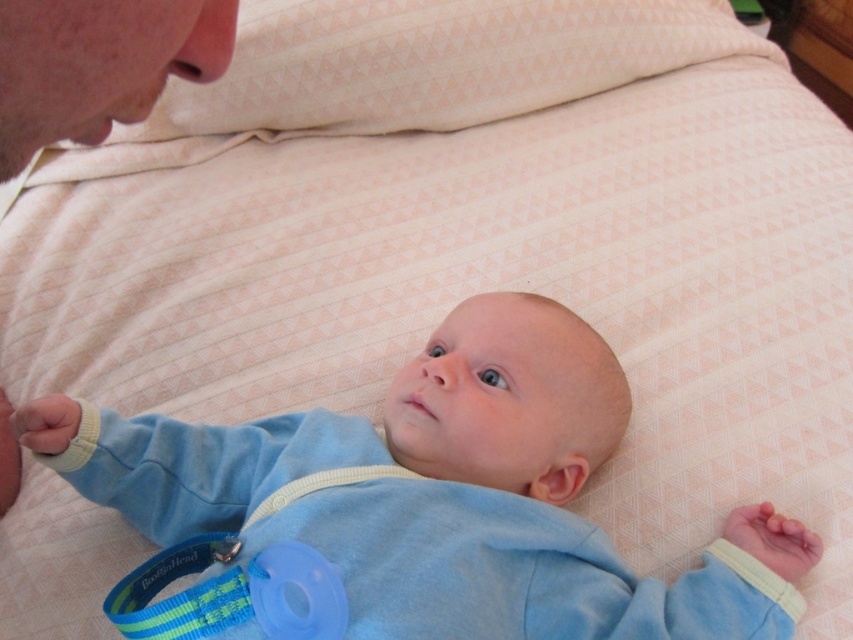
Question: Is light blue soft fabric baby at center above pink textured pillow at upper center?

Choices:
 (A) no
 (B) yes

Answer: (A)

Question: Does light blue soft fabric baby at center have a larger size compared to blue rubber teething ring at lower center?

Choices:
 (A) no
 (B) yes

Answer: (B)

Question: Considering the real-world distances, which object is closest to the blue rubber teething ring at lower center?

Choices:
 (A) light blue soft fabric baby at center
 (B) pink textured pillow at upper center

Answer: (A)

Question: Which object is positioned closest to the blue rubber teething ring at lower center?

Choices:
 (A) pink textured pillow at upper center
 (B) light blue soft fabric baby at center

Answer: (B)

Question: Does pink textured pillow at upper center have a lesser width compared to blue rubber teething ring at lower center?

Choices:
 (A) no
 (B) yes

Answer: (A)

Question: Which point appears farthest from the camera in this image?

Choices:
 (A) (329, 22)
 (B) (212, 548)

Answer: (A)